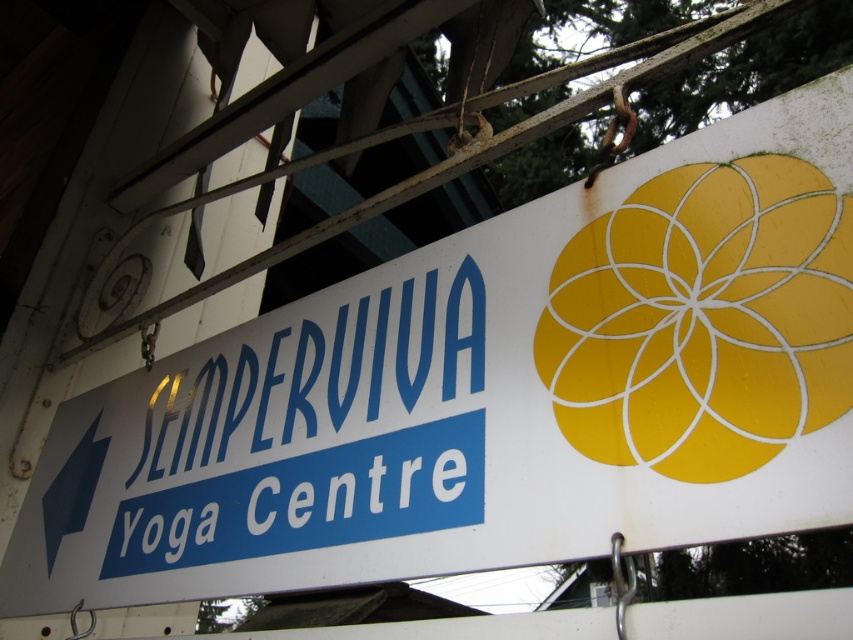
Is point (822, 225) farther from camera compared to point (413, 305)?

No, it is not.

Is yellow matte flower at upper right below blue metallic sign at center?

Actually, yellow matte flower at upper right is above blue metallic sign at center.

Measure the distance between point (752,321) and camera.

They are 27.29 inches apart.

In order to click on yellow matte flower at upper right in this screenshot , I will do `click(703, 320)`.